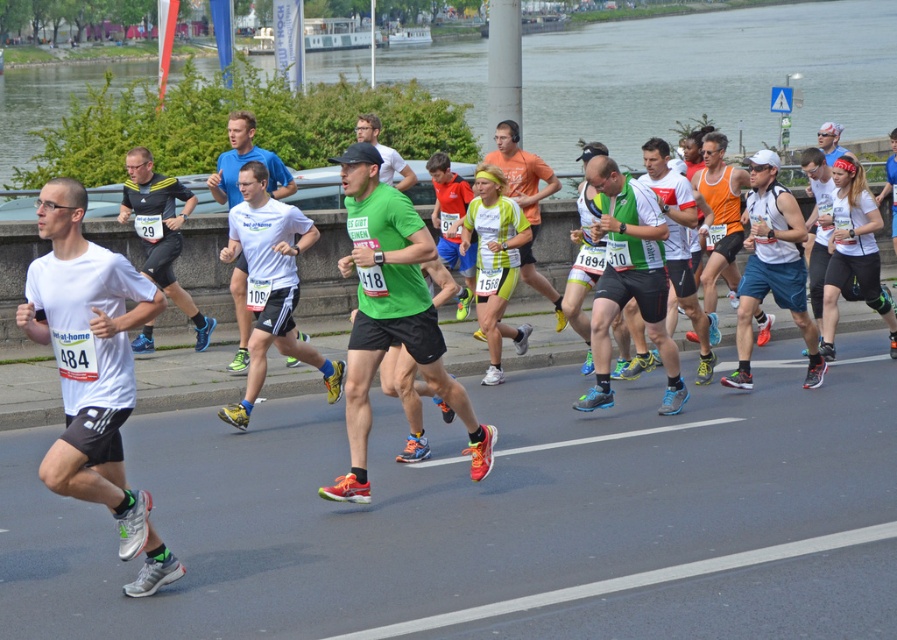
You are a photographer positioned at the origin of the coordinate system. You want to capture a photo of the green matte shirt at center. What are the coordinates where you should aim your camera?

The coordinates to aim your camera are at point (390, 314).

You are a photographer positioned at the transparent water at upper center and want to capture a runner wearing the white matte shirt at center in your shot. Considering the distance between them, can you estimate how far you need to move your camera to include both in the frame?

The transparent water at upper center and white matte shirt at center are 43.56 meters apart from each other. To include both in the frame, the photographer would need to adjust their camera angle or position to cover this distance, which may require a wide angle lens or moving closer to reduce the distance between them.

You are a photographer at the marathon event. You need to capture a photo that includes both the green matte shirt at center and the neon green jersey at center. Which one should you position on the left side of the photo to ensure both are visible?

To ensure both the green matte shirt at center and the neon green jersey at center are visible in the photo, position the green matte shirt at center on the left side since it is already to the left of the neon green jersey at center in the scene.